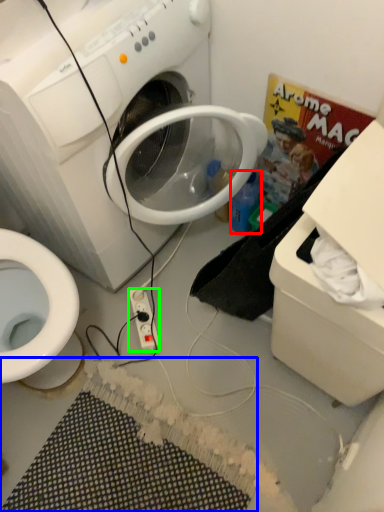
Question: Estimate the real-world distances between objects in this image. Which object is farther from bottle (highlighted by a red box), bath mat (highlighted by a blue box) or power outlet (highlighted by a green box)?

Choices:
 (A) bath mat
 (B) power outlet

Answer: (A)